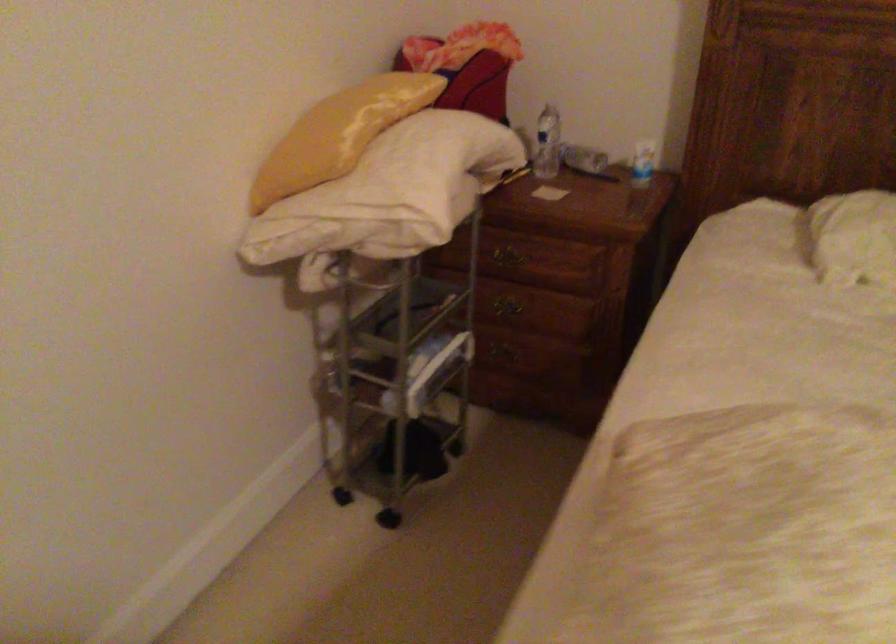
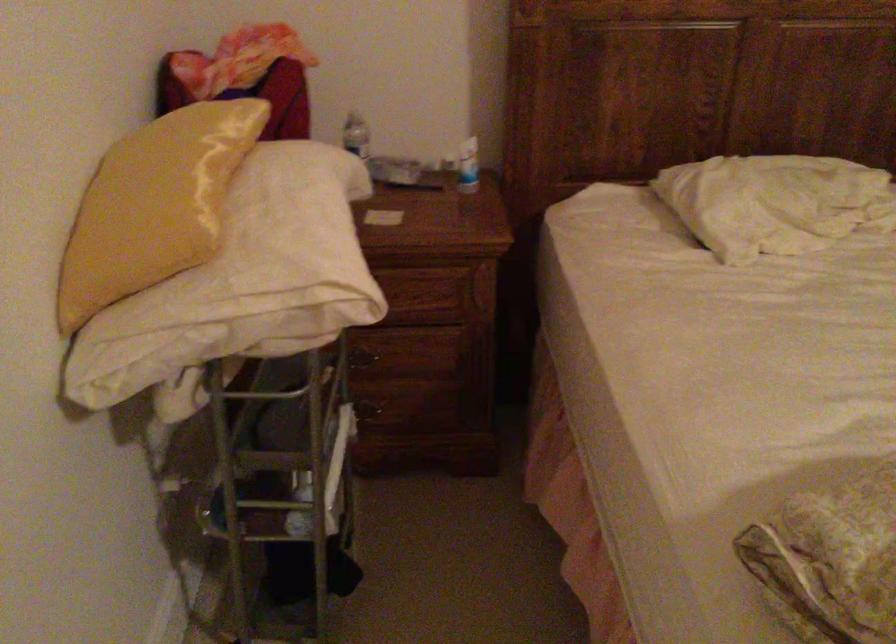
Question: The images are taken continuously from a first-person perspective. In which direction is your viewpoint rotating?

Choices:
 (A) Left
 (B) Right
 (C) Up
 (D) Down

Answer: (B)